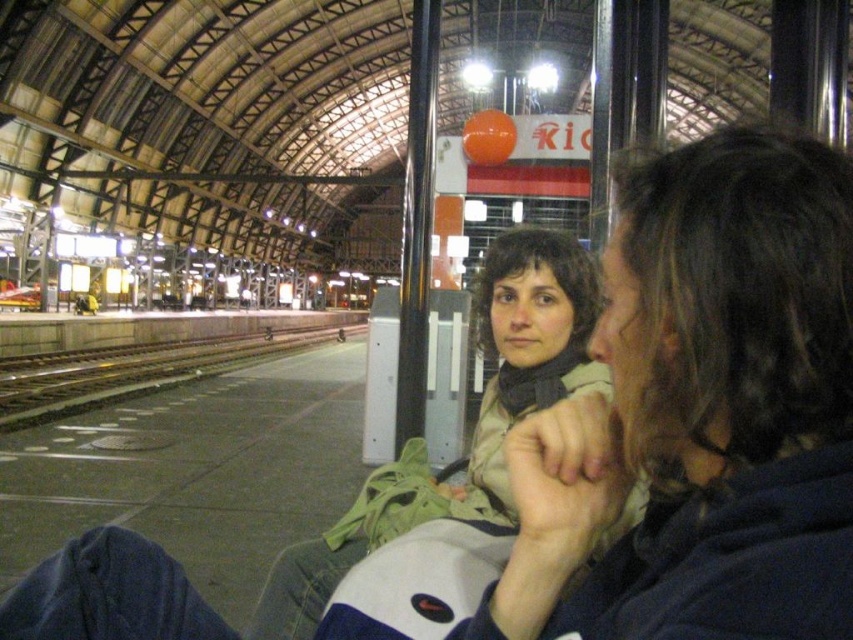
Is matte beige scarf at center wider than green fabric jacket at center?

No, matte beige scarf at center is not wider than green fabric jacket at center.

Is matte beige scarf at center shorter than green fabric jacket at center?

Yes, matte beige scarf at center is shorter than green fabric jacket at center.

Describe the element at coordinates (701, 412) in the screenshot. The height and width of the screenshot is (640, 853). I see `matte beige scarf at center` at that location.

I want to click on matte beige scarf at center, so click(701, 412).

Image resolution: width=853 pixels, height=640 pixels. What do you see at coordinates (474, 422) in the screenshot?
I see `green fabric jacket at center` at bounding box center [474, 422].

Measure the distance from green fabric jacket at center to black metal train track at left.

green fabric jacket at center is 15.97 meters away from black metal train track at left.

This screenshot has height=640, width=853. Find the location of `green fabric jacket at center`. green fabric jacket at center is located at coordinates (474, 422).

I want to click on green fabric jacket at center, so click(474, 422).

Between point (756, 419) and point (73, 408), which one is positioned behind?

The point (73, 408) is more distant.

Is matte beige scarf at center closer to camera compared to black metal train track at left?

Yes.

At what (x,y) coordinates should I click in order to perform the action: click on matte beige scarf at center. Please return your answer as a coordinate pair (x, y). Image resolution: width=853 pixels, height=640 pixels. Looking at the image, I should click on (701, 412).